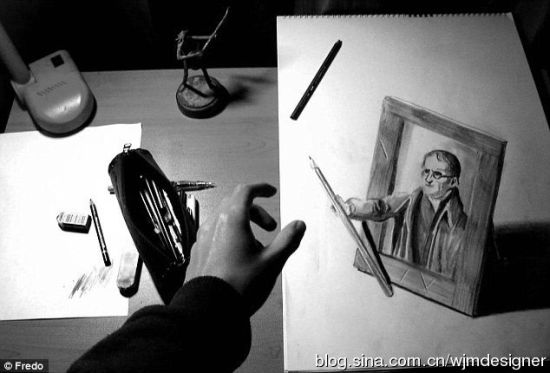
Locate an element on the screen. The image size is (550, 373). picture is located at coordinates (422, 241).